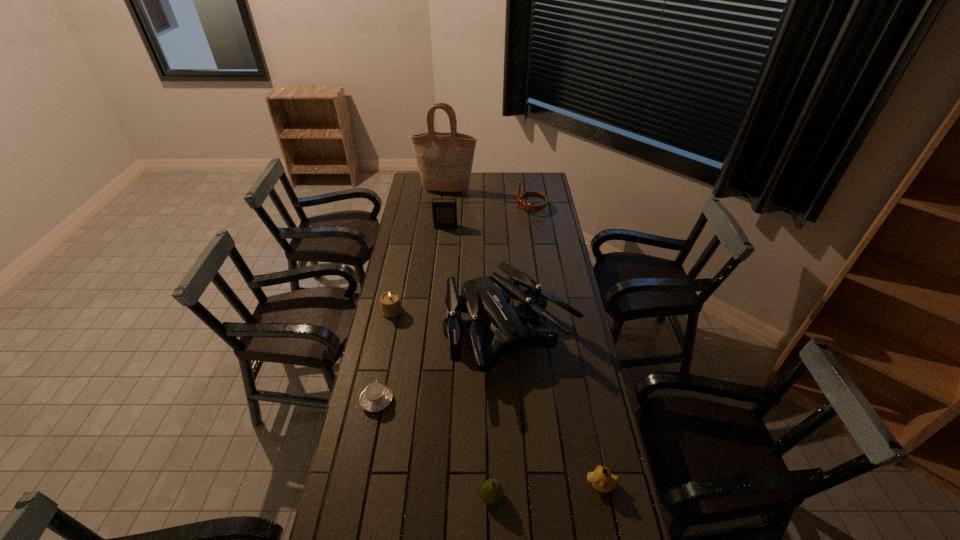
Find the location of a particular element. Image resolution: width=960 pixels, height=540 pixels. free space between the shopping bag and the teacup is located at coordinates (412, 296).

Find the location of a particular element. The width and height of the screenshot is (960, 540). free space between the pear and the teacup is located at coordinates (434, 449).

Identify the location of free space between the teacup and the drone. The height and width of the screenshot is (540, 960). click(444, 369).

Where is `unoccupied position between the diary and the duckling`? This screenshot has height=540, width=960. unoccupied position between the diary and the duckling is located at coordinates (522, 355).

The height and width of the screenshot is (540, 960). In order to click on free space between the candle_holder and the pear in this screenshot , I will do `click(442, 404)`.

I want to click on object that stands as the fourth closest to the tiara, so click(391, 305).

Identify the location of object that is the fifth nearest to the diary. The width and height of the screenshot is (960, 540). (376, 396).

This screenshot has width=960, height=540. I want to click on free space that satisfies the following two spatial constraints: 1. on the side with the handle of the teacup; 2. on the right side of the drone, so click(390, 336).